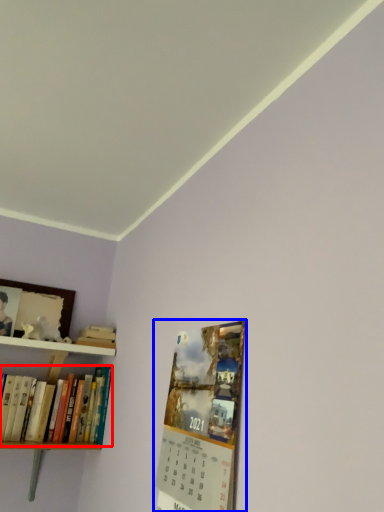
Question: Which object appears farthest to the camera in this image, book (highlighted by a red box) or magazine (highlighted by a blue box)?

Choices:
 (A) book
 (B) magazine

Answer: (A)